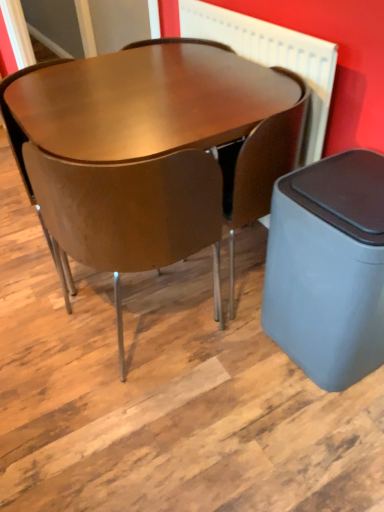
Locate an element on the screen. This screenshot has width=384, height=512. matte brown chair at center, the second chair when ordered from left to right is located at coordinates (260, 166).

What do you see at coordinates (272, 58) in the screenshot? I see `white textured radiator at upper center` at bounding box center [272, 58].

What do you see at coordinates (142, 105) in the screenshot?
I see `glossy wood table at center` at bounding box center [142, 105].

Locate an element on the screen. The image size is (384, 512). matte brown chair at center, the second chair when ordered from left to right is located at coordinates (260, 166).

From the image's perspective, which one is positioned higher, matte brown chair at center, the second chair positioned from the right, or glossy wood table at center?

glossy wood table at center.

Is matte brown chair at center, which is the 1th chair in left-to-right order, positioned far away from glossy wood table at center?

That's not correct — matte brown chair at center, which is the 1th chair in left-to-right order, is a little close to glossy wood table at center.

Who is shorter, matte brown chair at center, which is the 1th chair in left-to-right order, or glossy wood table at center?

glossy wood table at center.

Is matte brown chair at center, the second chair positioned from the right, turned away from glossy wood table at center?

Yes.

Considering the relative positions of gray matte waste bin at lower right and matte brown chair at center, the second chair positioned from the right, in the image provided, is gray matte waste bin at lower right to the left or to the right of matte brown chair at center, the second chair positioned from the right,?

gray matte waste bin at lower right is positioned on matte brown chair at center, the second chair positioned from the right,'s right side.

Is gray matte waste bin at lower right inside or outside of matte brown chair at center, the second chair positioned from the right?

gray matte waste bin at lower right exists outside the volume of matte brown chair at center, the second chair positioned from the right.

From a real-world perspective, is gray matte waste bin at lower right beneath matte brown chair at center, which is the 1th chair in left-to-right order?

Indeed, from a real-world perspective, gray matte waste bin at lower right is positioned beneath matte brown chair at center, which is the 1th chair in left-to-right order.

Where is `waste container below the matte brown chair at center, which is the 1th chair in left-to-right order (from the image's perspective)`? The height and width of the screenshot is (512, 384). waste container below the matte brown chair at center, which is the 1th chair in left-to-right order (from the image's perspective) is located at coordinates (328, 268).

Is gray matte waste bin at lower right positioned with its back to matte brown chair at center, which ranks as the 1th chair in right-to-left order?

No, gray matte waste bin at lower right's orientation is not away from matte brown chair at center, which ranks as the 1th chair in right-to-left order.

Can you confirm if gray matte waste bin at lower right is thinner than matte brown chair at center, which ranks as the 1th chair in right-to-left order?

Correct, the width of gray matte waste bin at lower right is less than that of matte brown chair at center, which ranks as the 1th chair in right-to-left order.

From the image's perspective, would you say gray matte waste bin at lower right is positioned over matte brown chair at center, which ranks as the 1th chair in right-to-left order?

No, from the image's perspective, gray matte waste bin at lower right is not above matte brown chair at center, which ranks as the 1th chair in right-to-left order.

The image size is (384, 512). In order to click on waste container below the matte brown chair at center, which ranks as the 1th chair in right-to-left order (from a real-world perspective) in this screenshot , I will do `click(328, 268)`.

Relative to matte brown chair at center, which is the 1th chair in left-to-right order, is glossy wood table at center in front or behind?

glossy wood table at center is positioned farther from the viewer than matte brown chair at center, which is the 1th chair in left-to-right order.

Measure the distance from glossy wood table at center to matte brown chair at center, which is the 1th chair in left-to-right order.

glossy wood table at center and matte brown chair at center, which is the 1th chair in left-to-right order, are 9.23 inches apart from each other.

From a real-world perspective, is glossy wood table at center over matte brown chair at center, the second chair positioned from the right?

Actually, glossy wood table at center is physically below matte brown chair at center, the second chair positioned from the right, in the real world.

Is glossy wood table at center directly adjacent to matte brown chair at center, the second chair positioned from the right?

No, glossy wood table at center is not next to matte brown chair at center, the second chair positioned from the right.

Can you see gray matte waste bin at lower right touching glossy wood table at center?

There is a gap between gray matte waste bin at lower right and glossy wood table at center.

This screenshot has width=384, height=512. In the image, there is a glossy wood table at center. In order to click on waste container below it (from the image's perspective) in this screenshot , I will do [328, 268].

From the image's perspective, which is below, gray matte waste bin at lower right or glossy wood table at center?

gray matte waste bin at lower right.

Considering the relative positions of gray matte waste bin at lower right and glossy wood table at center in the image provided, is gray matte waste bin at lower right to the right of glossy wood table at center from the viewer's perspective?

Yes, gray matte waste bin at lower right is to the right of glossy wood table at center.

From the image's perspective, is glossy wood table at center above white textured radiator at upper center?

Incorrect, from the image's perspective, glossy wood table at center is lower than white textured radiator at upper center.

Are glossy wood table at center and white textured radiator at upper center far apart?

glossy wood table at center is near white textured radiator at upper center, not far away.

The height and width of the screenshot is (512, 384). Identify the location of table that appears below the white textured radiator at upper center (from the image's perspective). (142, 105).

How many degrees apart are the facing directions of glossy wood table at center and white textured radiator at upper center?

0.171 degrees.

From a real-world perspective, is matte brown chair at center, the second chair when ordered from left to right, located beneath glossy wood table at center?

No, from a real-world perspective, matte brown chair at center, the second chair when ordered from left to right, is not beneath glossy wood table at center.

Considering the sizes of objects matte brown chair at center, which ranks as the 1th chair in right-to-left order, and glossy wood table at center in the image provided, who is smaller, matte brown chair at center, which ranks as the 1th chair in right-to-left order, or glossy wood table at center?

matte brown chair at center, which ranks as the 1th chair in right-to-left order.

Who is more distant, matte brown chair at center, which ranks as the 1th chair in right-to-left order, or glossy wood table at center?

matte brown chair at center, which ranks as the 1th chair in right-to-left order, is further away from the camera.

At what (x,y) coordinates should I click in order to perform the action: click on table behind the matte brown chair at center, the second chair positioned from the right. Please return your answer as a coordinate pair (x, y). The height and width of the screenshot is (512, 384). Looking at the image, I should click on coord(142,105).

Identify the location of waste container below the matte brown chair at center, which is the 1th chair in left-to-right order (from the image's perspective). The image size is (384, 512). (328, 268).

Based on the photo, when comparing their distances from matte brown chair at center, the second chair when ordered from left to right, does glossy wood table at center or white textured radiator at upper center seem further?

Based on the image, glossy wood table at center appears to be further to matte brown chair at center, the second chair when ordered from left to right.

Which object lies further to the anchor point matte brown chair at center, which ranks as the 1th chair in right-to-left order, white textured radiator at upper center or gray matte waste bin at lower right?

gray matte waste bin at lower right lies further to matte brown chair at center, which ranks as the 1th chair in right-to-left order, than the other object.

Which object lies further to the anchor point matte brown chair at center, the second chair positioned from the right, glossy wood table at center or matte brown chair at center, the second chair when ordered from left to right?

Among the two, matte brown chair at center, the second chair when ordered from left to right, is located further to matte brown chair at center, the second chair positioned from the right.

From the image, which object appears to be farther from gray matte waste bin at lower right, white textured radiator at upper center or matte brown chair at center, which ranks as the 1th chair in right-to-left order?

Among the two, white textured radiator at upper center is located further to gray matte waste bin at lower right.

Which object lies further to the anchor point glossy wood table at center, white textured radiator at upper center or matte brown chair at center, the second chair positioned from the right?

Based on the image, white textured radiator at upper center appears to be further to glossy wood table at center.

Estimate the real-world distances between objects in this image. Which object is closer to matte brown chair at center, which is the 1th chair in left-to-right order, gray matte waste bin at lower right or matte brown chair at center, which ranks as the 1th chair in right-to-left order?

The object closer to matte brown chair at center, which is the 1th chair in left-to-right order, is matte brown chair at center, which ranks as the 1th chair in right-to-left order.

From the image, which object appears to be farther from matte brown chair at center, the second chair when ordered from left to right, matte brown chair at center, the second chair positioned from the right, or glossy wood table at center?

matte brown chair at center, the second chair positioned from the right, is positioned further to the anchor matte brown chair at center, the second chair when ordered from left to right.

Which object lies further to the anchor point glossy wood table at center, gray matte waste bin at lower right or white textured radiator at upper center?

gray matte waste bin at lower right lies further to glossy wood table at center than the other object.

You are a GUI agent. You are given a task and a screenshot of the screen. Output one action in this format:
    pyautogui.click(x=<x>, y=<y>)
    Task: Click on the chair between matte brown chair at center, which is the 1th chair in left-to-right order, and gray matte waste bin at lower right, in the horizontal direction
    
    Given the screenshot: What is the action you would take?
    pyautogui.click(x=260, y=166)

At what (x,y) coordinates should I click in order to perform the action: click on chair between white textured radiator at upper center and matte brown chair at center, the second chair positioned from the right, in the up-down direction. Please return your answer as a coordinate pair (x, y). The height and width of the screenshot is (512, 384). Looking at the image, I should click on (260, 166).

Identify the location of table between white textured radiator at upper center and matte brown chair at center, which ranks as the 1th chair in right-to-left order, in the vertical direction. The image size is (384, 512). (142, 105).

Where is `chair between glossy wood table at center and gray matte waste bin at lower right`? Image resolution: width=384 pixels, height=512 pixels. chair between glossy wood table at center and gray matte waste bin at lower right is located at coordinates (260, 166).